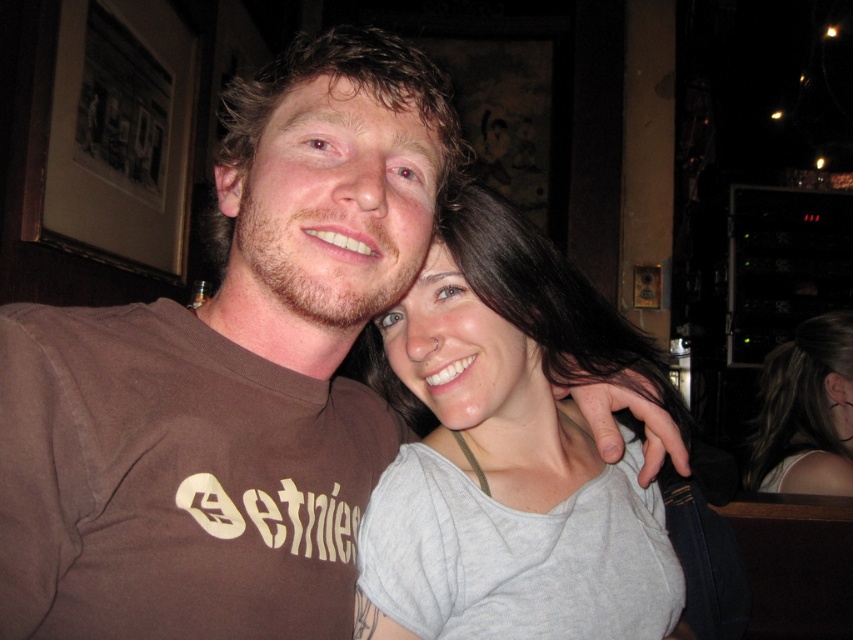
In the scene shown: Who is lower down, gray cotton shirt at center or gray fabric shirt at upper right?

Positioned lower is gray fabric shirt at upper right.

Between gray cotton shirt at center and gray fabric shirt at upper right, which one has less height?

Standing shorter between the two is gray cotton shirt at center.

Image resolution: width=853 pixels, height=640 pixels. Identify the location of gray cotton shirt at center. (509, 449).